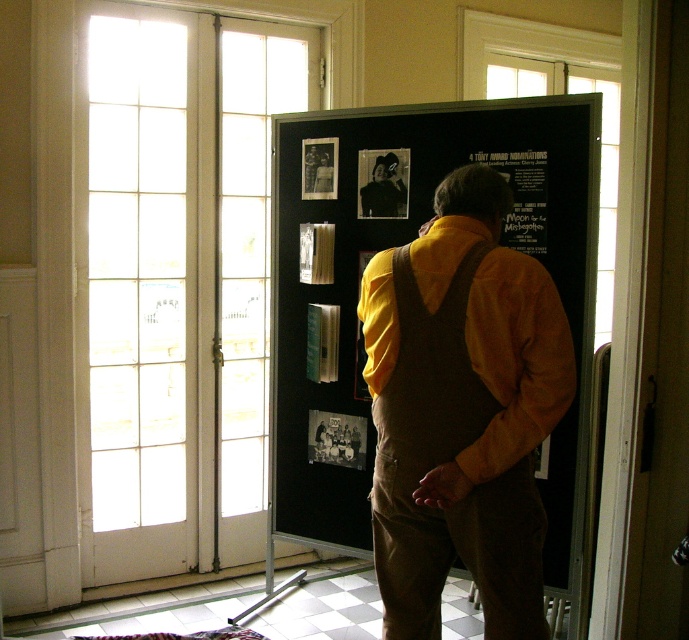
You are a stagehand who needs to adjust the position of the brown suede overalls at center and the matte black poster at center so that they are exactly 36 inches apart. Given their current distance, how much further do you need to move them apart?

The brown suede overalls at center and matte black poster at center are currently 30.78 inches apart. To reach the desired 36 inches, you need to increase the distance by 5.22 inches.

You are a photographer in the room and want to capture a photo of the matte black poster at center without the brown suede overalls at center blocking it. Is this possible?

The brown suede overalls at center is taller than the matte black poster at center, so the overalls will block the poster in the photo.

You are an interior designer planning to hang a new picture frame in this room. You want to ensure it doesn not block the black paper poster at upper center or the wooden frame at center. Considering their sizes, which object should you avoid placing a larger frame near?

The black paper poster at upper center is bigger than the wooden frame at center, so you should avoid placing a larger frame near the black paper poster at upper center to prevent blocking it.